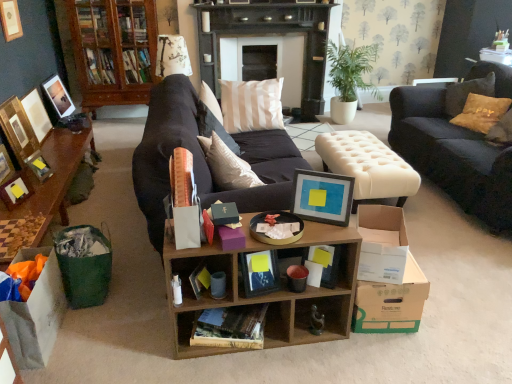
Question: Relative to cardboard box at lower right, placed as the 3th cardboard box when sorted from left to right, is matte white picture frame at left, marked as the fifth picture frame in a right-to-left arrangement, in front or behind?

Choices:
 (A) front
 (B) behind

Answer: (B)

Question: Considering the positions of matte white picture frame at left, marked as the fifth picture frame in a right-to-left arrangement, and cardboard box at lower right, placed as the 3th cardboard box when sorted from left to right, in the image, is matte white picture frame at left, marked as the fifth picture frame in a right-to-left arrangement, taller or shorter than cardboard box at lower right, placed as the 3th cardboard box when sorted from left to right,?

Choices:
 (A) short
 (B) tall

Answer: (B)

Question: Considering the real-world distances, which object is closest to the cream tufted ottoman at center?

Choices:
 (A) matte gold picture frame at upper left, which is the 2th picture frame in left-to-right order
 (B) matte black picture frame at upper left, which ranks as the 1th picture frame in left-to-right order
 (C) matte black picture frame at left, arranged as the 6th picture frame when viewed from the left
 (D) matte white picture frame at upper left, the 6th picture frame in the right-to-left sequence
 (E) dark blue fabric couch at right

Answer: (E)

Question: Which of these objects is positioned farthest from the matte black book at center, which is the 1th book in top-to-bottom order?

Choices:
 (A) matte black picture frame at left, the second picture frame positioned from the right
 (B) cardboard box at lower right, which ranks as the first cardboard box in right-to-left order
 (C) dark blue fabric couch at right
 (D) wooden cube shelf at center, the first shelf viewed from the left
 (E) brown cardboard book at center, marked as the second book in a top-to-bottom arrangement

Answer: (C)